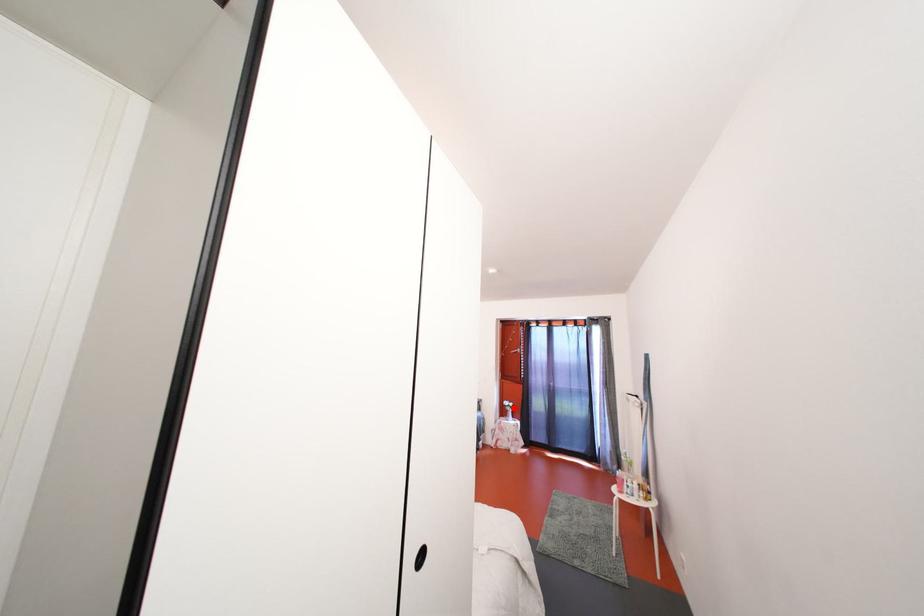
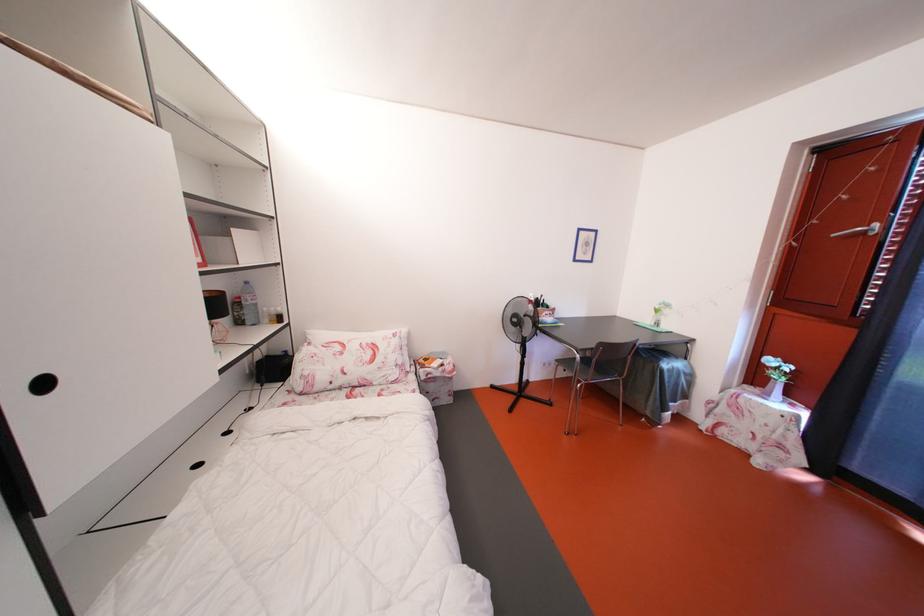
Find the pixel in the second image that matches the highlighted location in the first image.

(779, 367)